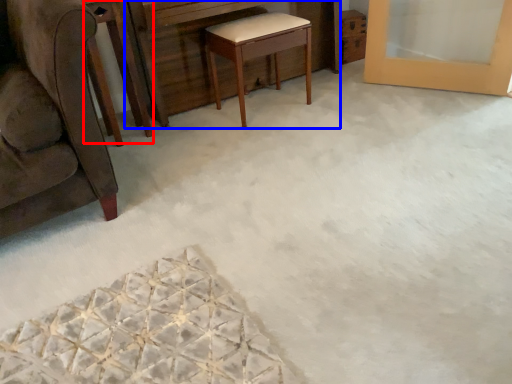
Question: Which of the following is the closest to the observer, round table (highlighted by a red box) or vanity (highlighted by a blue box)?

Choices:
 (A) round table
 (B) vanity

Answer: (A)